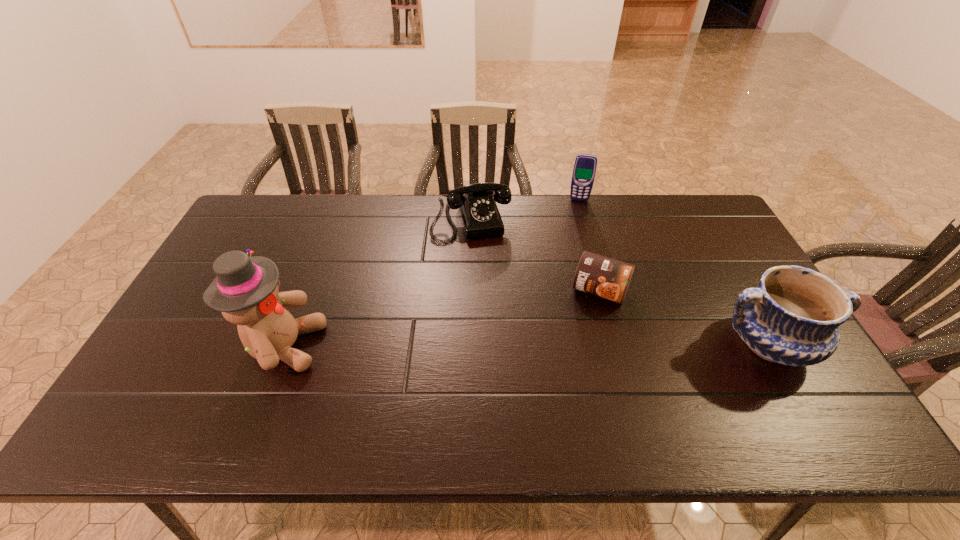
This screenshot has width=960, height=540. Identify the location of rag_doll. (246, 290).

Where is `the tallest object`? the tallest object is located at coordinates [246, 290].

I want to click on pottery, so click(792, 318).

I want to click on the shortest object, so click(598, 275).

You are a GUI agent. You are given a task and a screenshot of the screen. Output one action in this format:
    pyautogui.click(x=<x>, y=<y>)
    Task: Click on the cellular telephone
    
    Given the screenshot: What is the action you would take?
    pyautogui.click(x=584, y=170)

Identify the location of the fourth object from right to left. The height and width of the screenshot is (540, 960). (480, 217).

This screenshot has width=960, height=540. What are the coordinates of `the fourth tallest object` in the screenshot? It's located at 480,217.

Where is `free spot located 0.300m on the front-facing side of the leftmost object`? The height and width of the screenshot is (540, 960). free spot located 0.300m on the front-facing side of the leftmost object is located at coordinates (438, 346).

What are the coordinates of `vacant point located 0.370m on the back of the pottery` in the screenshot? It's located at (703, 227).

This screenshot has height=540, width=960. Find the location of `vacant space located 0.230m on the front label of the can`. vacant space located 0.230m on the front label of the can is located at coordinates (565, 374).